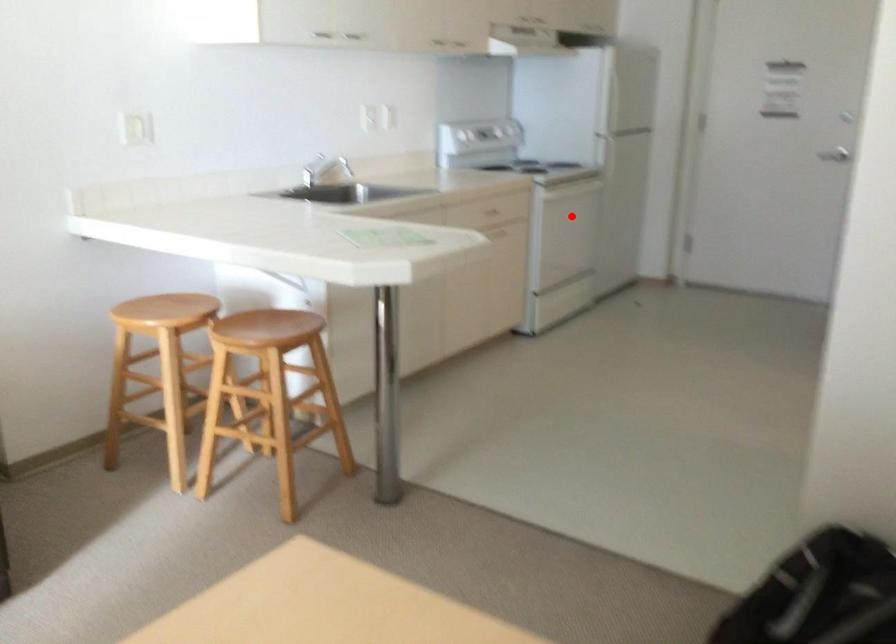
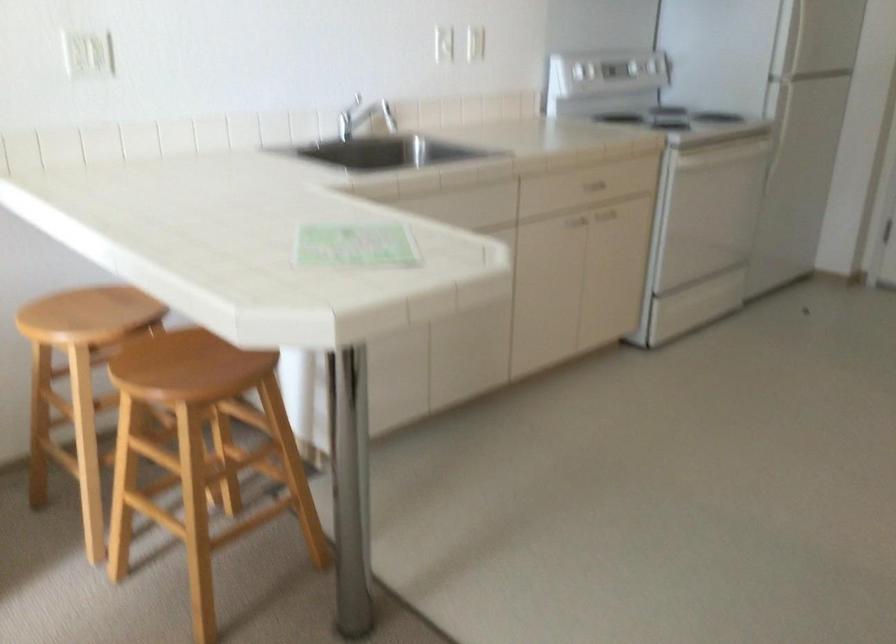
Where in the second image is the point corresponding to the highlighted location from the first image?

(714, 202)